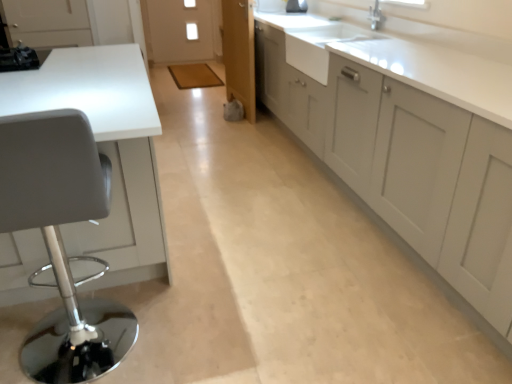
Question: Is white glossy countertop at left oriented towards matte gray cabinets at right?

Choices:
 (A) no
 (B) yes

Answer: (A)

Question: Considering the relative sizes of white glossy countertop at left and matte gray cabinets at right in the image provided, is white glossy countertop at left bigger than matte gray cabinets at right?

Choices:
 (A) no
 (B) yes

Answer: (A)

Question: Does white glossy countertop at left have a lesser width compared to matte gray cabinets at right?

Choices:
 (A) no
 (B) yes

Answer: (A)

Question: From a real-world perspective, is white glossy countertop at left physically above matte gray cabinets at right?

Choices:
 (A) no
 (B) yes

Answer: (A)

Question: Is white glossy countertop at left at the right side of matte gray cabinets at right?

Choices:
 (A) yes
 (B) no

Answer: (B)

Question: From the image's perspective, is white glossy countertop at left located above matte gray cabinets at right?

Choices:
 (A) yes
 (B) no

Answer: (B)

Question: Considering the relative sizes of matte gray cabinets at right and white ceramic sink at upper right in the image provided, is matte gray cabinets at right taller than white ceramic sink at upper right?

Choices:
 (A) yes
 (B) no

Answer: (A)

Question: Is matte gray cabinets at right to the left of white ceramic sink at upper right from the viewer's perspective?

Choices:
 (A) no
 (B) yes

Answer: (A)

Question: Does matte gray cabinets at right have a lesser width compared to white ceramic sink at upper right?

Choices:
 (A) yes
 (B) no

Answer: (B)

Question: Is matte gray cabinets at right outside of white ceramic sink at upper right?

Choices:
 (A) no
 (B) yes

Answer: (B)

Question: From a real-world perspective, is matte gray cabinets at right beneath white ceramic sink at upper right?

Choices:
 (A) yes
 (B) no

Answer: (A)

Question: From a real-world perspective, does matte gray cabinets at right stand above white ceramic sink at upper right?

Choices:
 (A) no
 (B) yes

Answer: (A)

Question: Considering the relative positions of white glossy countertop at left and white ceramic sink at upper right in the image provided, is white glossy countertop at left in front of white ceramic sink at upper right?

Choices:
 (A) yes
 (B) no

Answer: (A)